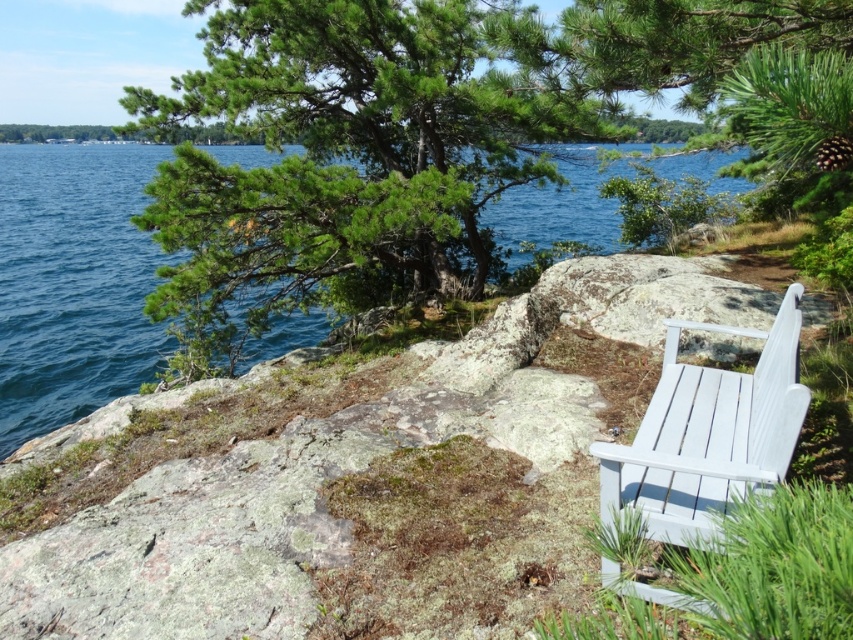
You are planning to take a photo of the white painted wood bench at right and the blue water at upper left. To ensure both are in the frame, where should you position the camera relative to the bench?

The blue water at upper left is to the left of the white painted wood bench at right, so you should position the camera to the left side of the bench to include both the bench and the water in the frame.

You are planning to place a small potted plant between the white wood bench at right and the blue water at upper left. Based on their widths, which object should the plant be placed closer to?

The white wood bench at right has a lesser width compared to blue water at upper left, so the plant should be placed closer to the blue water at upper left to maintain balance between the two objects.

You are a photographer standing at the lakeside scene. You want to take a photo that includes both the blue water at upper left and the white painted wood bench at right. Given that your camera has a maximum focus range of 15 meters, will you be able to capture both subjects in focus without moving your position?

The blue water at upper left and the white painted wood bench at right are 16.10 meters apart from each other. Since the distance between them exceeds the camera maximum focus range of 15 meters, you will not be able to capture both subjects in focus without moving your position.